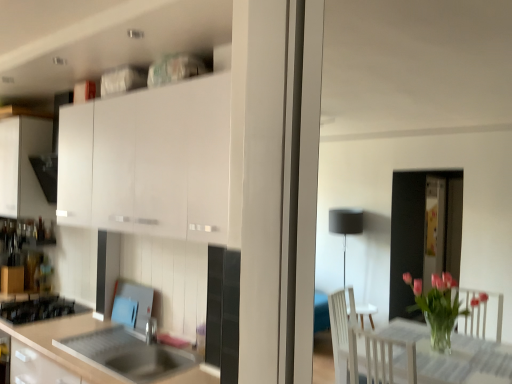
Question: From a real-world perspective, is matte white cabinet at left, which appears as the second cabinetry when viewed from the right, on white matte cabinet at upper left, which ranks as the 2th cabinetry in left-to-right order?

Choices:
 (A) no
 (B) yes

Answer: (A)

Question: Does matte white cabinet at left, the first cabinetry from the back, come behind white matte cabinet at upper left, placed as the 2th cabinetry when sorted from back to front?

Choices:
 (A) yes
 (B) no

Answer: (A)

Question: Considering the relative positions of matte white cabinet at left, which appears as the second cabinetry when viewed from the right, and white matte cabinet at upper left, placed as the 2th cabinetry when sorted from back to front, in the image provided, is matte white cabinet at left, which appears as the second cabinetry when viewed from the right, to the right of white matte cabinet at upper left, placed as the 2th cabinetry when sorted from back to front, from the viewer's perspective?

Choices:
 (A) no
 (B) yes

Answer: (A)

Question: Is white matte cabinet at upper left, which ranks as the first cabinetry in front-to-back order, a part of matte white cabinet at left, arranged as the 2th cabinetry when viewed from the front?

Choices:
 (A) yes
 (B) no

Answer: (B)

Question: Can you confirm if matte white cabinet at left, placed as the first cabinetry when sorted from left to right, is thinner than white matte cabinet at upper left, placed as the 2th cabinetry when sorted from back to front?

Choices:
 (A) yes
 (B) no

Answer: (B)

Question: Relative to stainless steel sink at lower left, is black glass gas stove at lower left in front or behind?

Choices:
 (A) front
 (B) behind

Answer: (B)

Question: Based on their sizes in the image, would you say black glass gas stove at lower left is bigger or smaller than stainless steel sink at lower left?

Choices:
 (A) big
 (B) small

Answer: (B)

Question: Is black glass gas stove at lower left to the left or to the right of stainless steel sink at lower left in the image?

Choices:
 (A) left
 (B) right

Answer: (A)

Question: From a real-world perspective, is black glass gas stove at lower left above or below stainless steel sink at lower left?

Choices:
 (A) above
 (B) below

Answer: (A)

Question: From the image's perspective, is stainless steel sink at lower left positioned above or below white matte cabinet at upper left, placed as the first cabinetry when sorted from right to left?

Choices:
 (A) above
 (B) below

Answer: (B)

Question: From a real-world perspective, is stainless steel sink at lower left positioned above or below white matte cabinet at upper left, placed as the 2th cabinetry when sorted from back to front?

Choices:
 (A) below
 (B) above

Answer: (A)

Question: Based on their sizes in the image, would you say stainless steel sink at lower left is bigger or smaller than white matte cabinet at upper left, placed as the 2th cabinetry when sorted from back to front?

Choices:
 (A) big
 (B) small

Answer: (B)

Question: Is stainless steel sink at lower left in front of or behind white matte cabinet at upper left, placed as the first cabinetry when sorted from right to left, in the image?

Choices:
 (A) behind
 (B) front

Answer: (A)

Question: From a real-world perspective, is matte white cabinet at left, which appears as the second cabinetry when viewed from the right, above or below stainless steel sink at lower left?

Choices:
 (A) below
 (B) above

Answer: (B)

Question: Is matte white cabinet at left, arranged as the 2th cabinetry when viewed from the front, bigger or smaller than stainless steel sink at lower left?

Choices:
 (A) big
 (B) small

Answer: (A)